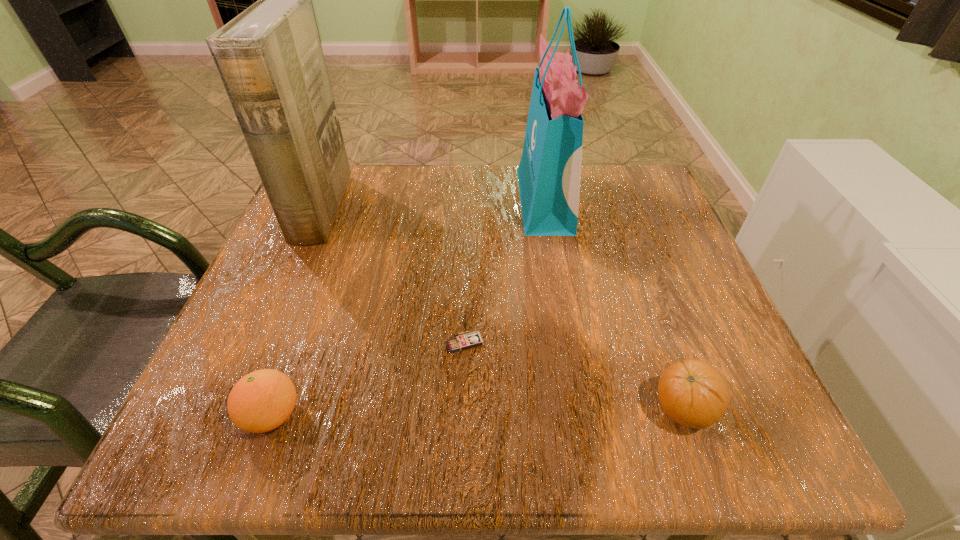
You are a GUI agent. You are given a task and a screenshot of the screen. Output one action in this format:
    pyautogui.click(x=<x>, y=<y>)
    Task: Click on the vacant space at the near edge
    This screenshot has width=960, height=540.
    Given the screenshot: What is the action you would take?
    pyautogui.click(x=469, y=404)

The width and height of the screenshot is (960, 540). Identify the location of free space at the right edge. (673, 244).

Find the location of a particular element. This screenshot has height=540, width=960. vacant space at the far left corner is located at coordinates (370, 177).

The width and height of the screenshot is (960, 540). I want to click on blank space at the near left corner of the desktop, so click(x=196, y=418).

You are a GUI agent. You are given a task and a screenshot of the screen. Output one action in this format:
    pyautogui.click(x=<x>, y=<y>)
    Task: Click on the vacant space at the far right corner of the desktop
    The width and height of the screenshot is (960, 540).
    Given the screenshot: What is the action you would take?
    pyautogui.click(x=646, y=193)

The image size is (960, 540). I want to click on vacant space that's between the phonebook and the fourth object from left to right, so click(433, 205).

In order to click on free spot between the third farthest object and the left orange in this screenshot , I will do [x=369, y=379].

The width and height of the screenshot is (960, 540). I want to click on vacant space in between the shopping bag and the phonebook, so click(433, 205).

I want to click on vacant point located between the phonebook and the shopping bag, so click(x=433, y=205).

In order to click on free point between the phonebook and the third object from left to right in this screenshot , I will do `click(393, 276)`.